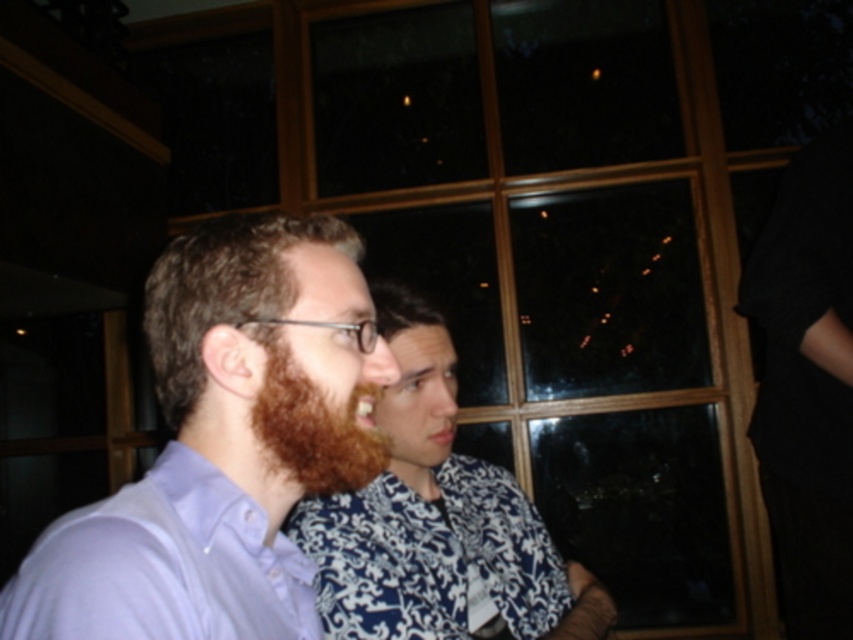
You are a fashion designer observing two purple shirts in a photo. The matte purple shirt at center and the light purple cotton shirt at left are part of the scene. Which of these two shirts is positioned higher up in the image?

Result: The matte purple shirt at center is taller than the light purple cotton shirt at left, so the matte purple shirt at center is positioned higher up in the image.

You are a photographer trying to capture a closeup of the facial features of the two people in the image. Given that the brown hair at center and the brown fuzzy beard at center are both in focus, which one would appear more prominent in the photo?

The brown hair at center would appear more prominent in the photo since it is larger in size than the brown fuzzy beard at center.

Based on the scene description, which object from the list is wider? The brown hair at center or the brown fuzzy beard at center?

The brown hair at center is wider than the brown fuzzy beard at center according to the description.